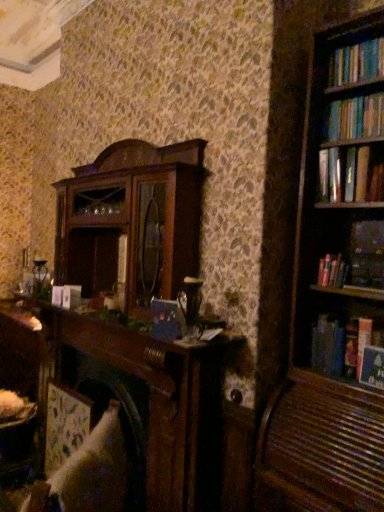
Question: Considering the relative sizes of hardcover book at right, which is counted as the second book, starting from the top, and white fabric swivel chair at lower left in the image provided, is hardcover book at right, which is counted as the second book, starting from the top, wider than white fabric swivel chair at lower left?

Choices:
 (A) yes
 (B) no

Answer: (B)

Question: Does hardcover book at right, positioned as the 4th book in bottom-to-top order, lie behind white fabric swivel chair at lower left?

Choices:
 (A) yes
 (B) no

Answer: (A)

Question: Considering the relative sizes of hardcover book at right, which is counted as the second book, starting from the top, and white fabric swivel chair at lower left in the image provided, is hardcover book at right, which is counted as the second book, starting from the top, smaller than white fabric swivel chair at lower left?

Choices:
 (A) yes
 (B) no

Answer: (A)

Question: Is hardcover book at right, positioned as the 4th book in bottom-to-top order, at the right side of white fabric swivel chair at lower left?

Choices:
 (A) no
 (B) yes

Answer: (B)

Question: Is hardcover book at right, which is counted as the second book, starting from the top, directly adjacent to white fabric swivel chair at lower left?

Choices:
 (A) no
 (B) yes

Answer: (A)

Question: Considering the relative sizes of hardcover book at right, which is counted as the second book, starting from the top, and white fabric swivel chair at lower left in the image provided, is hardcover book at right, which is counted as the second book, starting from the top, shorter than white fabric swivel chair at lower left?

Choices:
 (A) no
 (B) yes

Answer: (B)

Question: Does hardcover book at right, positioned as the 4th book in bottom-to-top order, have a lesser width compared to hardcover book at right, the third book from the top?

Choices:
 (A) no
 (B) yes

Answer: (A)

Question: Is hardcover book at right, positioned as the 4th book in bottom-to-top order, next to hardcover book at right, positioned as the 3th book in bottom-to-top order, and touching it?

Choices:
 (A) yes
 (B) no

Answer: (A)

Question: Considering the relative sizes of hardcover book at right, positioned as the 4th book in bottom-to-top order, and hardcover book at right, positioned as the 3th book in bottom-to-top order, in the image provided, is hardcover book at right, positioned as the 4th book in bottom-to-top order, shorter than hardcover book at right, positioned as the 3th book in bottom-to-top order,?

Choices:
 (A) yes
 (B) no

Answer: (B)

Question: From a real-world perspective, is hardcover book at right, positioned as the 4th book in bottom-to-top order, located higher than hardcover book at right, the third book from the top?

Choices:
 (A) yes
 (B) no

Answer: (A)

Question: Is hardcover book at right, which is counted as the second book, starting from the top, not inside hardcover book at right, the third book from the top?

Choices:
 (A) no
 (B) yes

Answer: (B)

Question: From the image's perspective, would you say hardcover book at right, which is counted as the second book, starting from the top, is positioned over hardcover book at right, the third book from the top?

Choices:
 (A) no
 (B) yes

Answer: (B)

Question: Is hardcover book at upper right, the fifth book in the top-to-bottom sequence, bigger than hardcover book at right, which is counted as the second book, starting from the top?

Choices:
 (A) no
 (B) yes

Answer: (A)